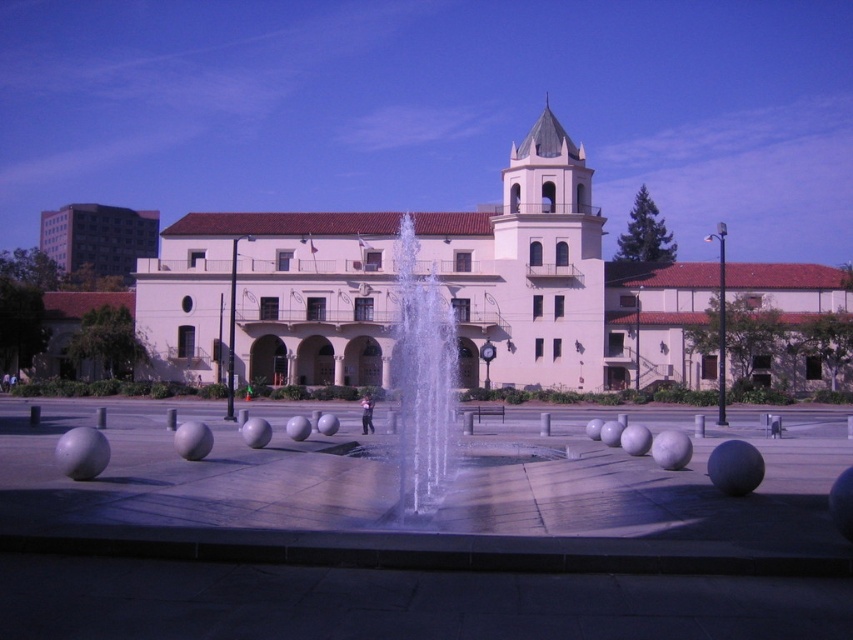
Question: Which object is closer to the camera taking this photo?

Choices:
 (A) white stucco building at center
 (B) clear glass water at center

Answer: (B)

Question: Is white stucco building at center below clear glass water at center?

Choices:
 (A) no
 (B) yes

Answer: (A)

Question: Where is white stucco building at center located in relation to clear glass water at center in the image?

Choices:
 (A) above
 (B) below

Answer: (A)

Question: Which point appears farthest from the camera in this image?

Choices:
 (A) (173, 369)
 (B) (433, 400)

Answer: (A)

Question: Considering the relative positions of white stucco building at center and clear glass water at center in the image provided, where is white stucco building at center located with respect to clear glass water at center?

Choices:
 (A) right
 (B) left

Answer: (A)